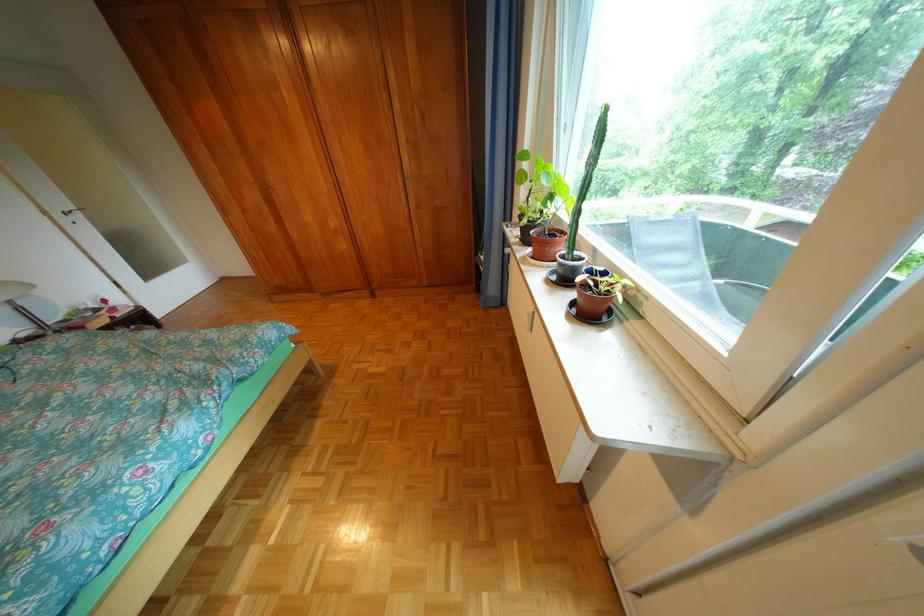
In order to click on silver door handle in this screenshot , I will do `click(71, 212)`.